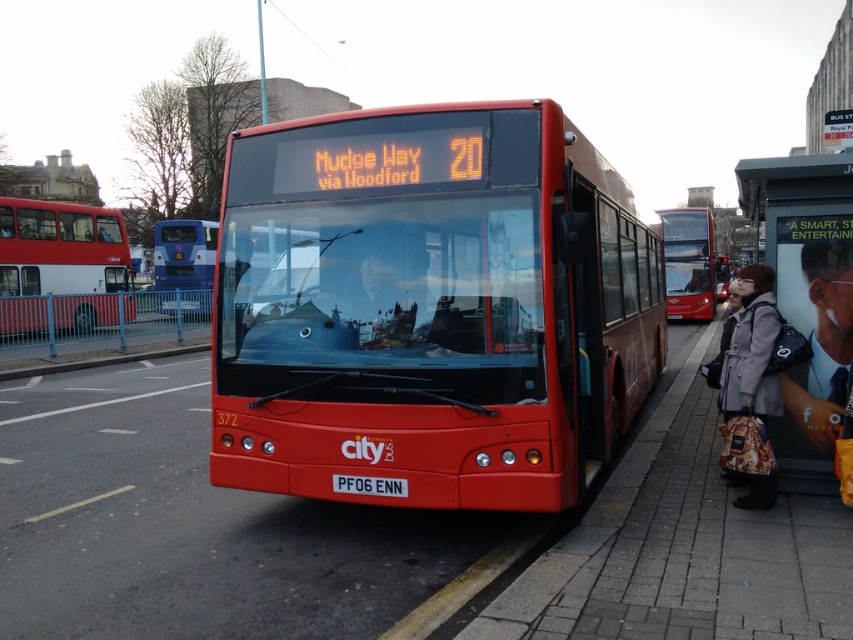
Question: Which point is closer to the camera?

Choices:
 (A) (194, 228)
 (B) (747, 490)
 (C) (108, 218)
 (D) (692, 224)

Answer: (B)

Question: Can you confirm if smooth black tie at center is thinner than white plastic license plate at center?

Choices:
 (A) no
 (B) yes

Answer: (B)

Question: Which point is farther from the camera taking this photo?

Choices:
 (A) (706, 307)
 (B) (184, 225)

Answer: (B)

Question: Considering the real-world distances, which object is farthest from the metallic gray bus stop at right?

Choices:
 (A) matte red bus at left
 (B) matte red bus at center
 (C) brick pavement at center
 (D) white plastic license plate at center

Answer: (A)

Question: Is brick pavement at center thinner than gray wool coat at lower right?

Choices:
 (A) yes
 (B) no

Answer: (B)

Question: From the image, what is the correct spatial relationship of shiny red bus at center in relation to gray wool coat at lower right?

Choices:
 (A) above
 (B) below

Answer: (A)